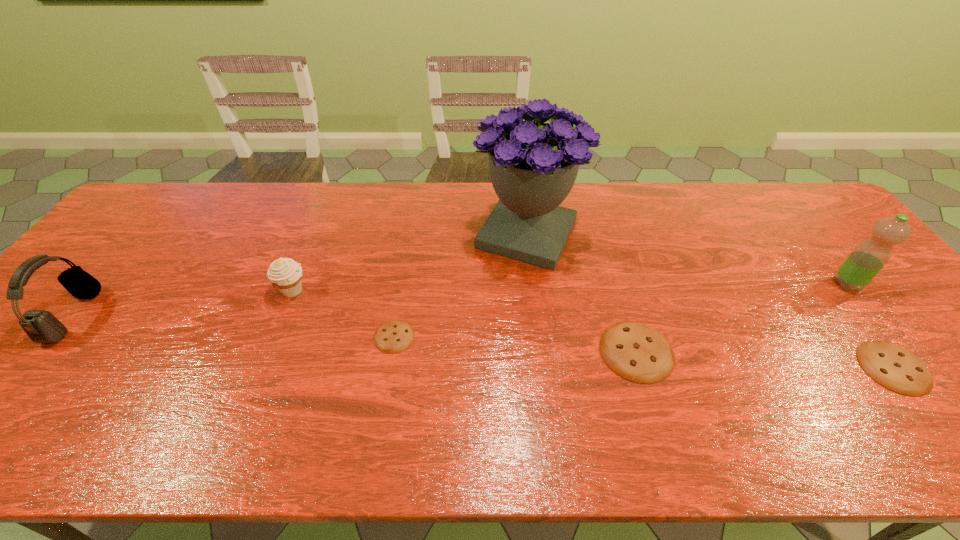
What are the coordinates of `object that is at the left edge` in the screenshot? It's located at pos(41,326).

Locate an element on the screen. This screenshot has width=960, height=540. cookie present at the right edge is located at coordinates [x=895, y=368].

This screenshot has height=540, width=960. I want to click on water bottle that is at the right edge, so pyautogui.click(x=869, y=256).

Image resolution: width=960 pixels, height=540 pixels. I want to click on object present at the near right corner, so click(895, 368).

The height and width of the screenshot is (540, 960). In order to click on free space at the far edge of the desktop in this screenshot , I will do `click(660, 192)`.

The image size is (960, 540). In the image, there is a desktop. Identify the location of free space at the near edge. (348, 379).

Locate an element on the screen. The image size is (960, 540). vacant area at the left edge of the desktop is located at coordinates (160, 233).

The image size is (960, 540). Find the location of `vacant space at the right edge`. vacant space at the right edge is located at coordinates (909, 315).

This screenshot has width=960, height=540. I want to click on vacant space at the far left corner, so click(x=161, y=204).

The image size is (960, 540). In order to click on vacant region at the far right corner of the desktop in this screenshot , I will do `click(820, 208)`.